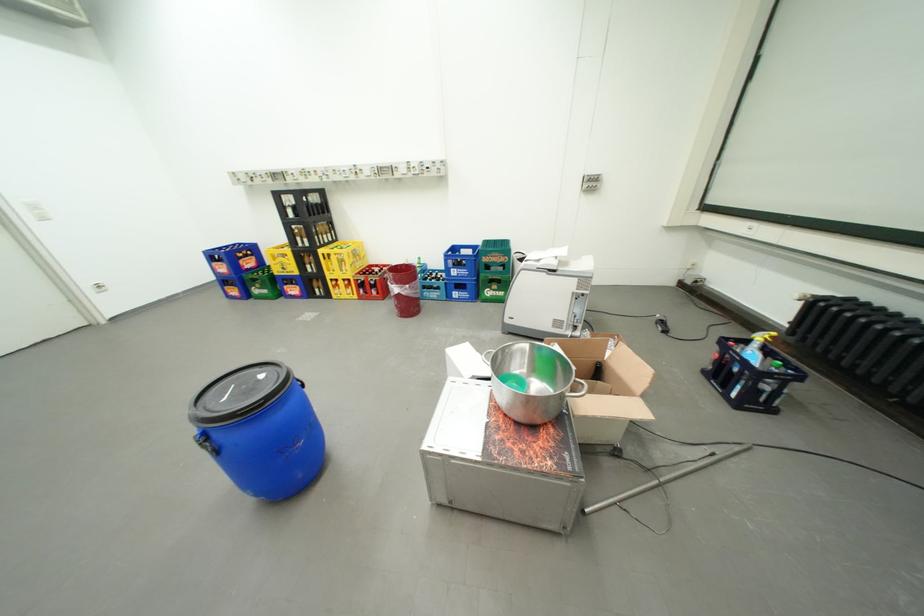
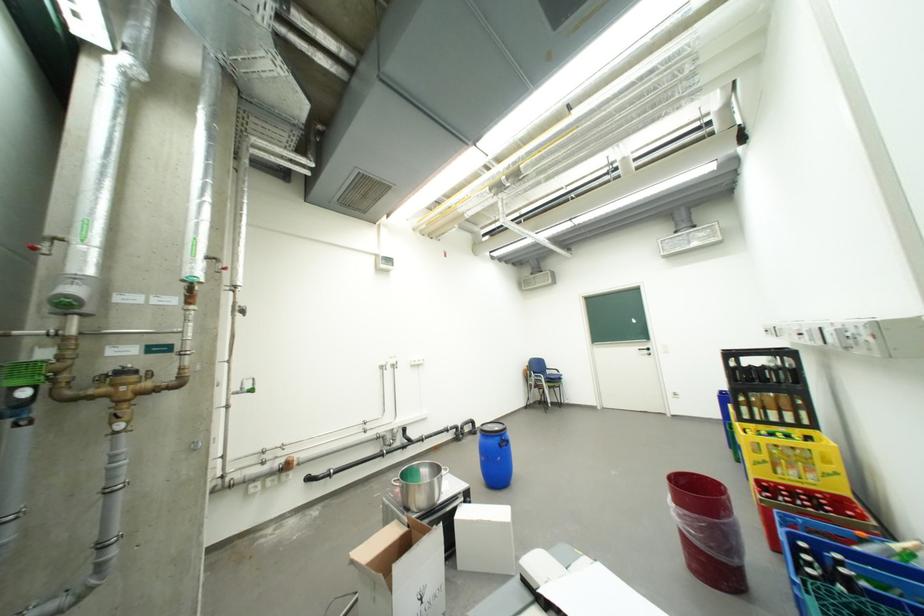
Locate, in the second image, the point that corresponds to pixel 418 286 in the first image.

(685, 507)